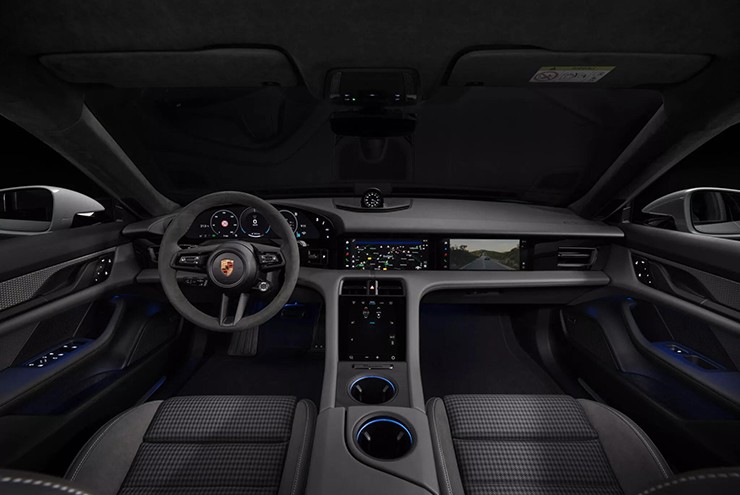
The image size is (740, 495). In order to click on clock in this screenshot , I will do `click(374, 207)`.